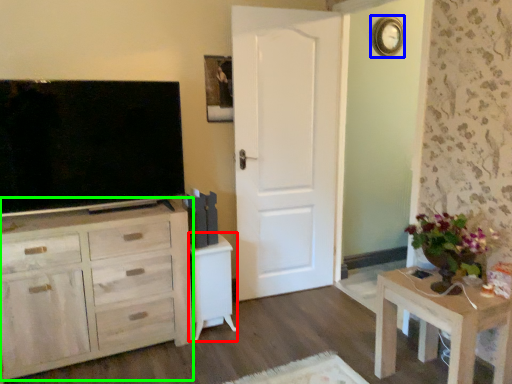
Question: Estimate the real-world distances between objects in this image. Which object is closer to vanity (highlighted by a red box), clock (highlighted by a blue box) or cabinetry (highlighted by a green box)?

Choices:
 (A) clock
 (B) cabinetry

Answer: (B)